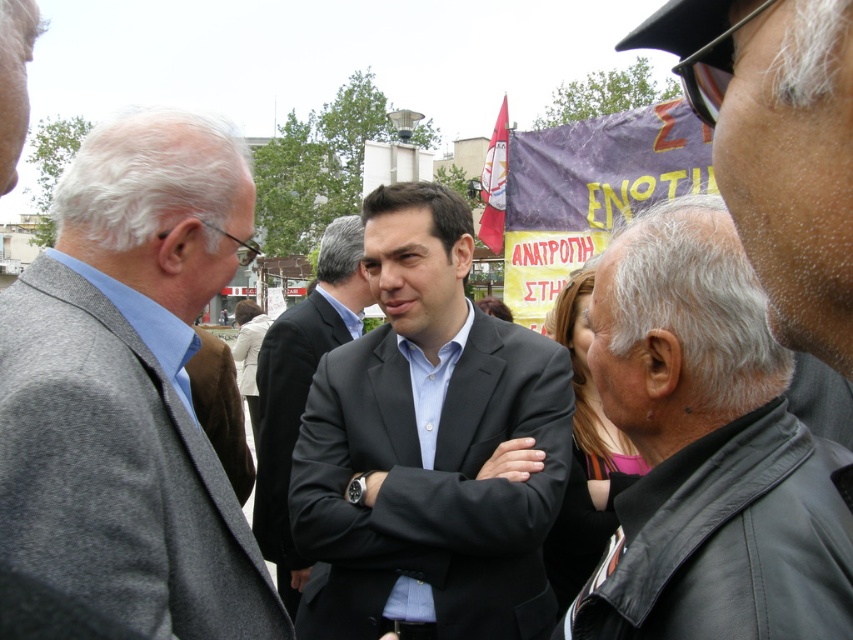
Question: Which object is farther from the camera taking this photo?

Choices:
 (A) matte black suit at center
 (B) dark gray suit at center
 (C) black leather jacket at right
 (D) gray woolen suit at left

Answer: (B)

Question: Which of the following is the farthest from the observer?

Choices:
 (A) (207, 508)
 (B) (283, 440)
 (C) (370, 193)

Answer: (B)

Question: Is gray woolen suit at left below matte black suit at center?

Choices:
 (A) yes
 (B) no

Answer: (B)

Question: Based on their relative distances, which object is farther from the black leather jacket at right?

Choices:
 (A) dark gray suit at center
 (B) matte black suit at center
 (C) gray woolen suit at left

Answer: (A)

Question: In this image, where is matte black suit at center located relative to dark gray suit at center?

Choices:
 (A) left
 (B) right

Answer: (B)

Question: Is matte black suit at center smaller than dark gray suit at center?

Choices:
 (A) no
 (B) yes

Answer: (B)